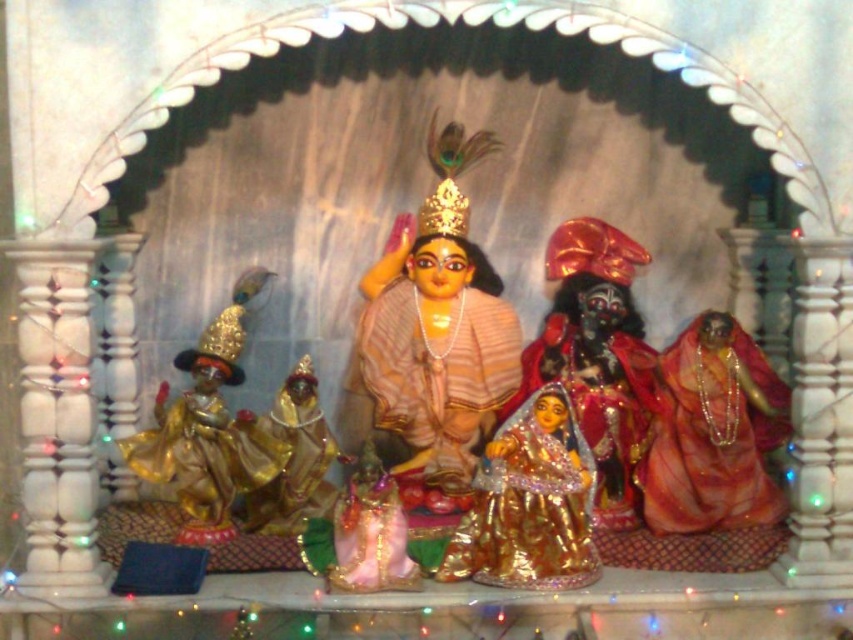
Question: Is shiny gold statue at center closer to camera compared to gold metallic statue at center?

Choices:
 (A) yes
 (B) no

Answer: (B)

Question: Which point appears farthest from the camera in this image?

Choices:
 (A) (373, 364)
 (B) (689, 400)
 (C) (328, 429)

Answer: (C)

Question: Does shiny gold statue at right lie behind gold metallic figure at left?

Choices:
 (A) yes
 (B) no

Answer: (A)

Question: Among these objects, which one is nearest to the camera?

Choices:
 (A) matte gold statue at center
 (B) gold metallic statue at center

Answer: (B)

Question: Among these points, which one is farthest from the camera?

Choices:
 (A) (378, 561)
 (B) (430, 262)
 (C) (572, 445)

Answer: (B)

Question: Is shiny gold statue at right to the right of shiny gold statue at center from the viewer's perspective?

Choices:
 (A) yes
 (B) no

Answer: (A)